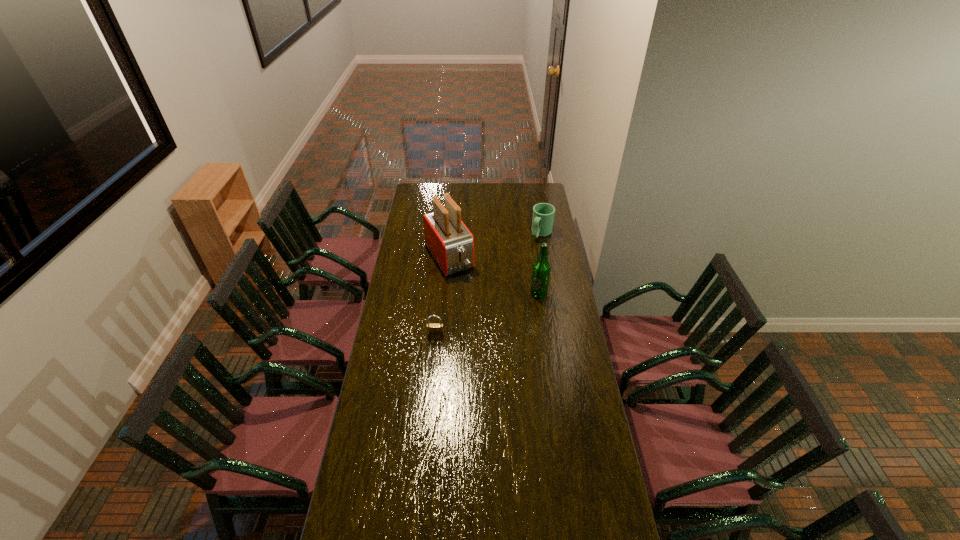
In order to click on free space at the near right corner in this screenshot , I will do `click(599, 521)`.

I want to click on vacant area that lies between the shortest object and the beer bottle, so click(x=487, y=314).

I want to click on vacant region between the toaster and the second shortest object, so click(495, 245).

Find the location of `free space between the beer bottle and the padlock`. free space between the beer bottle and the padlock is located at coordinates (487, 314).

The width and height of the screenshot is (960, 540). I want to click on free area in between the second nearest object and the nearest object, so click(487, 314).

I want to click on free area in between the beer bottle and the shortest object, so click(x=487, y=314).

At what (x,y) coordinates should I click in order to perform the action: click on free point between the toaster and the padlock. Please return your answer as a coordinate pair (x, y). Image resolution: width=960 pixels, height=540 pixels. Looking at the image, I should click on (x=443, y=295).

Where is `vacant region between the toaster and the shortest object`? The width and height of the screenshot is (960, 540). vacant region between the toaster and the shortest object is located at coordinates (443, 295).

The image size is (960, 540). What are the coordinates of `free space between the nearest object and the mug` in the screenshot? It's located at 489,284.

Identify which object is the third closest to the toaster. Please provide its 2D coordinates. Your answer should be formatted as a tuple, i.e. [(x, y)], where the tuple contains the x and y coordinates of a point satisfying the conditions above.

[(434, 329)]